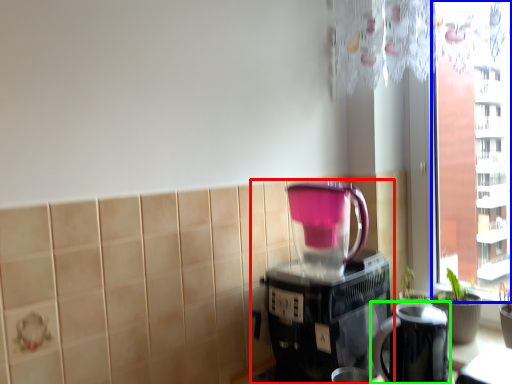
Question: Based on their relative distances, which object is nearer to coffee maker (highlighted by a red box)? Choose from window screen (highlighted by a blue box) and appliance (highlighted by a green box).

Choices:
 (A) window screen
 (B) appliance

Answer: (B)